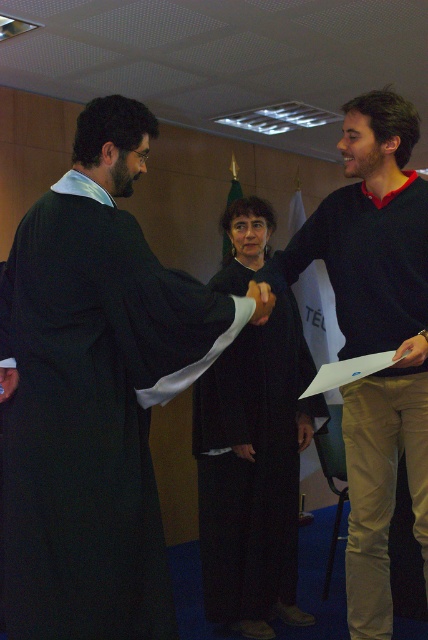
In the scene shown: You are standing in the room where the handshake is happening. There are two points marked in the image. The first point is at coordinates point (x=59, y=618) and the second is at point (x=409, y=250). Which point is closer to you?

The point at coordinates point (x=59, y=618) is closer to you because it is in front of point (x=409, y=250).

You are a photographer standing at the back of the room. You want to take a photo of the black matte sweater at right and the black matte robe at center. The camera you are using has a minimum focus distance of 30 inches. Will you be able to capture both subjects clearly in the photo?

The distance between the black matte sweater at right and the black matte robe at center is 27.73 inches, which is less than the camera minimum focus distance of 30 inches. Therefore, you can capture both subjects clearly in the photo.